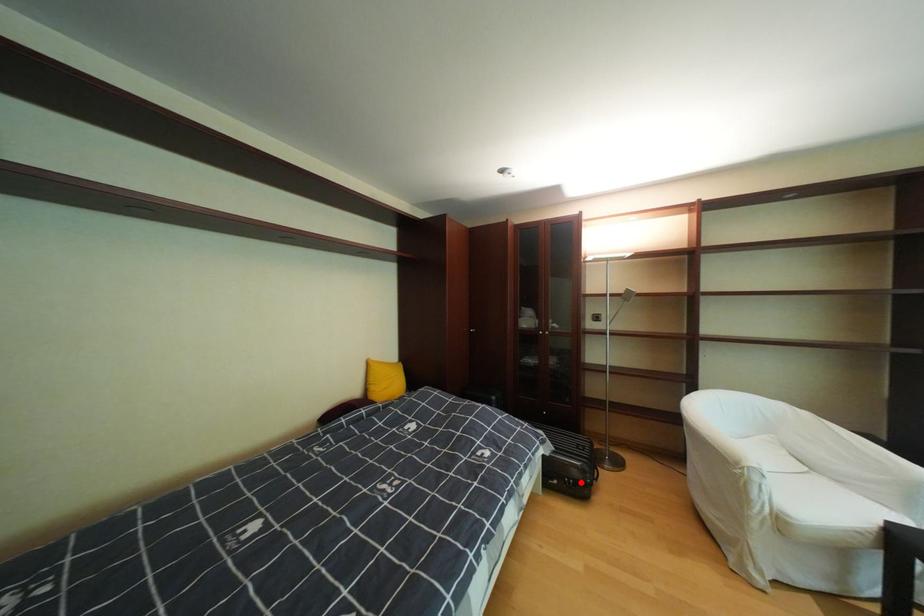
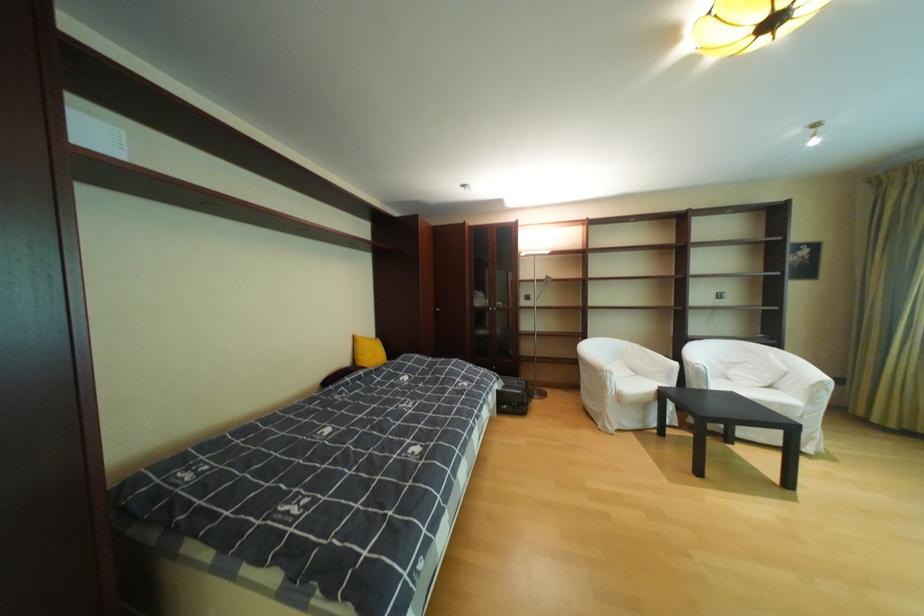
The point at the highlighted location is marked in the first image. Where is the corresponding point in the second image?

(526, 405)